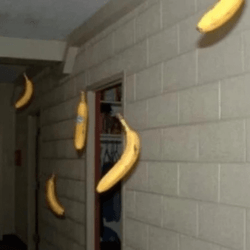
Identify the location of light switch on wall. This screenshot has height=250, width=250. (18, 158).